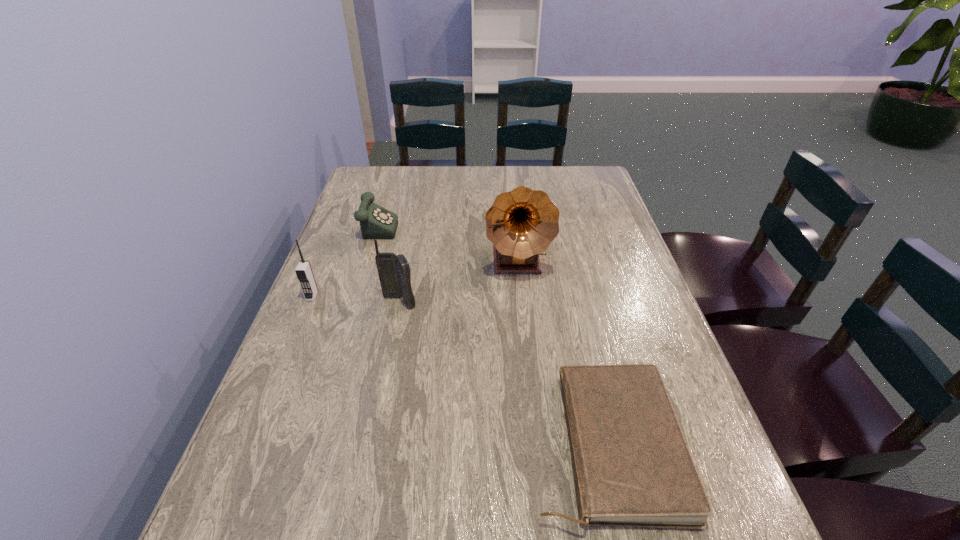
At what (x,y) coordinates should I click in order to perform the action: click on object that is the second nearest to the phonograph_record. Please return your answer as a coordinate pair (x, y). Image resolution: width=960 pixels, height=540 pixels. Looking at the image, I should click on (376, 222).

The image size is (960, 540). Identify the location of free space in the image that satisfies the following two spatial constraints: 1. on the dial of the telephone; 2. on the front-facing side of the leftmost object. (353, 296).

Locate an element on the screen. free space that satisfies the following two spatial constraints: 1. on the dial of the telephone; 2. on the front-facing side of the left cellular telephone is located at coordinates (353, 296).